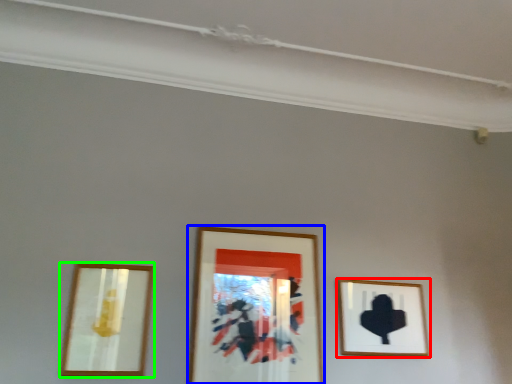
Question: Which is farther away from picture frame (highlighted by a red box)? picture frame (highlighted by a blue box) or picture frame (highlighted by a green box)?

Choices:
 (A) picture frame
 (B) picture frame

Answer: (B)